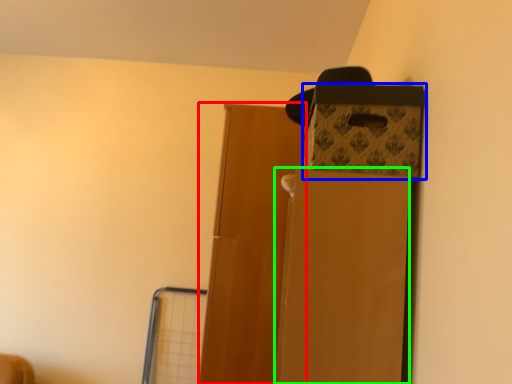
Question: Considering the real-world distances, which object is closest to door (highlighted by a red box)? storage box (highlighted by a blue box) or cardboard box (highlighted by a green box).

Choices:
 (A) storage box
 (B) cardboard box

Answer: (A)